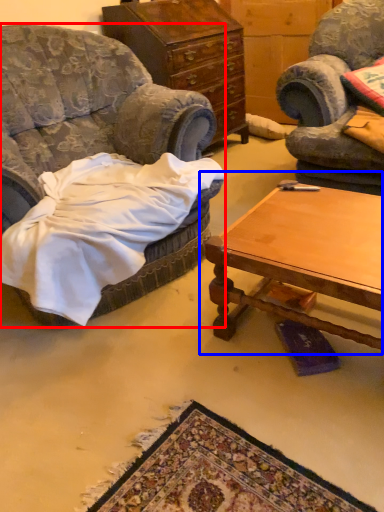
Question: Which point is further to the camera, chair (highlighted by a red box) or coffee table (highlighted by a blue box)?

Choices:
 (A) chair
 (B) coffee table

Answer: (B)